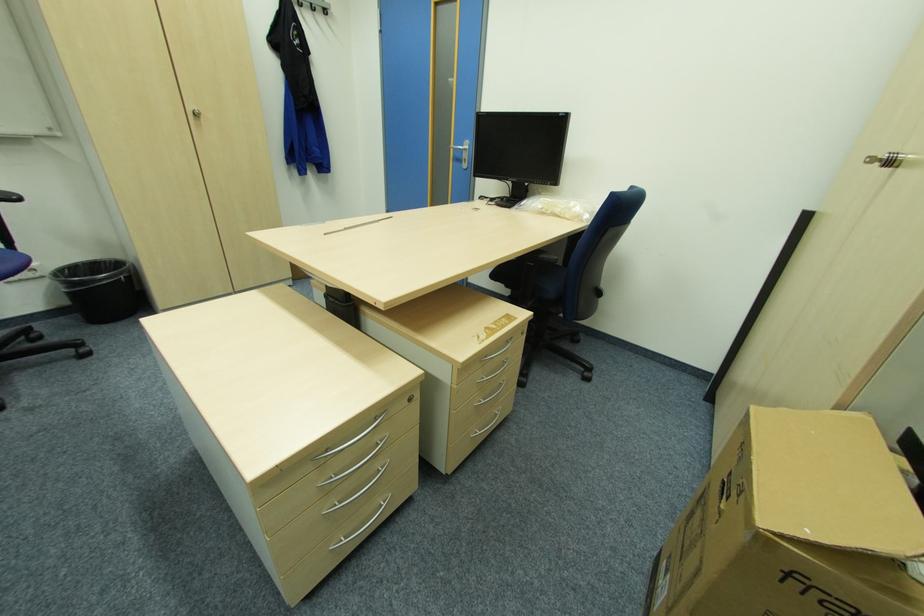
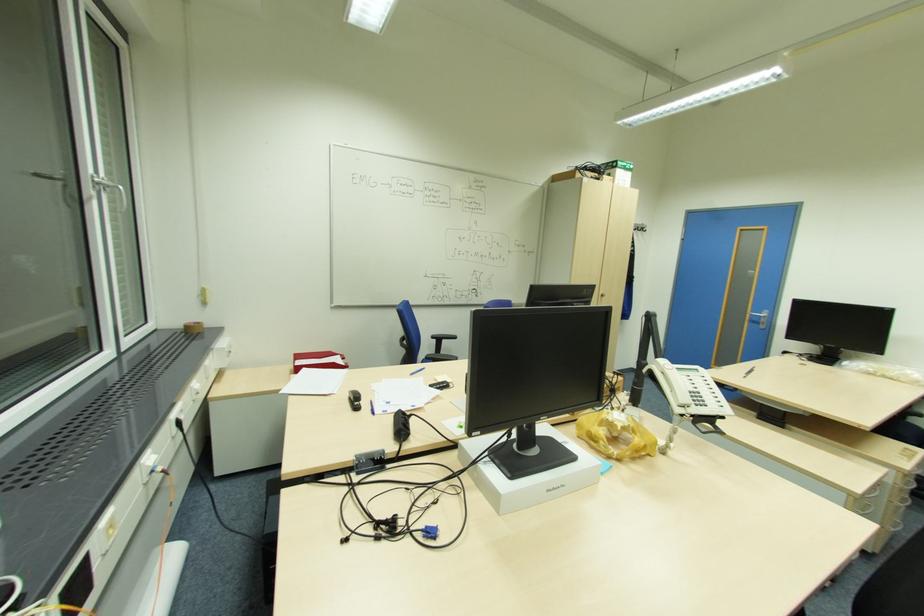
The point at (x=468, y=159) is marked in the first image. Where is the corresponding point in the second image?

(766, 323)